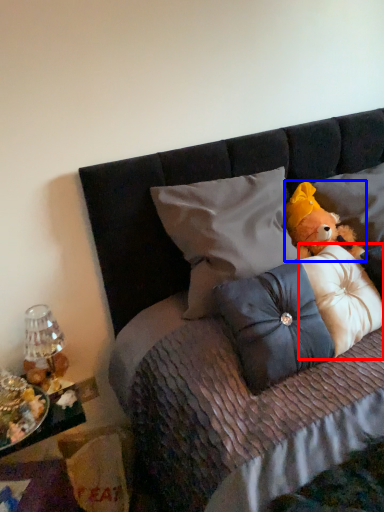
Question: Which of the following is the farthest to the observer, pillow (highlighted by a red box) or teddy bear (highlighted by a blue box)?

Choices:
 (A) pillow
 (B) teddy bear

Answer: (B)